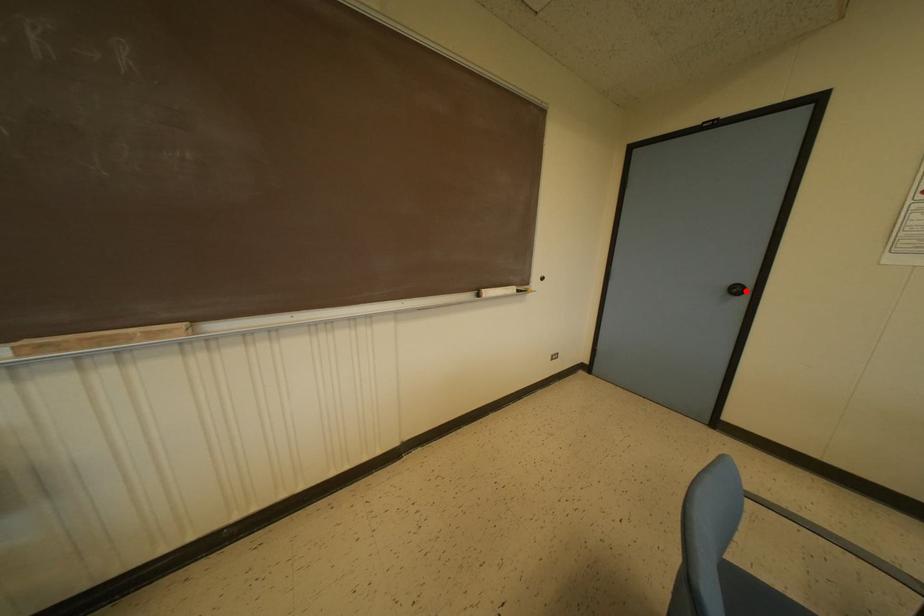
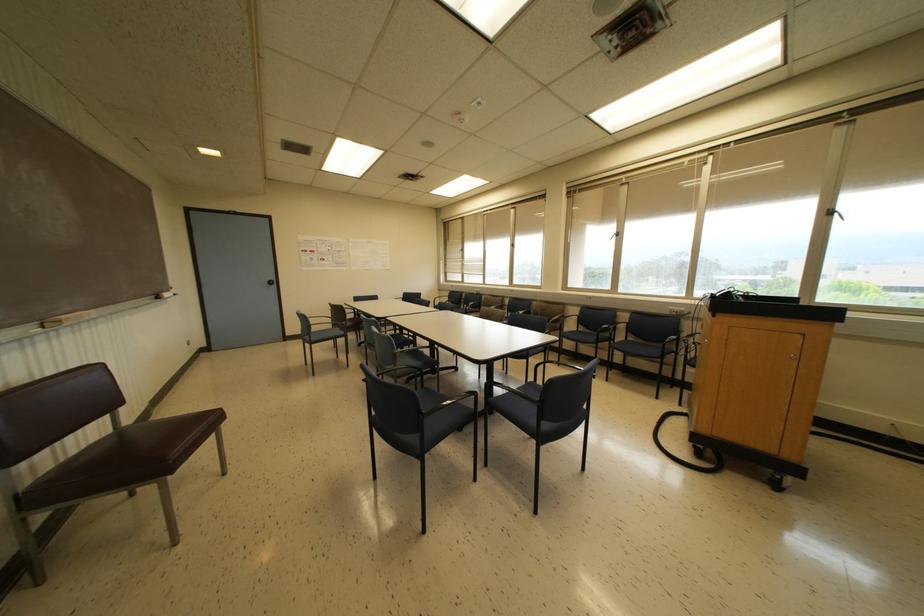
Locate, in the second image, the point that corresponds to the highlighted location in the first image.

(274, 282)